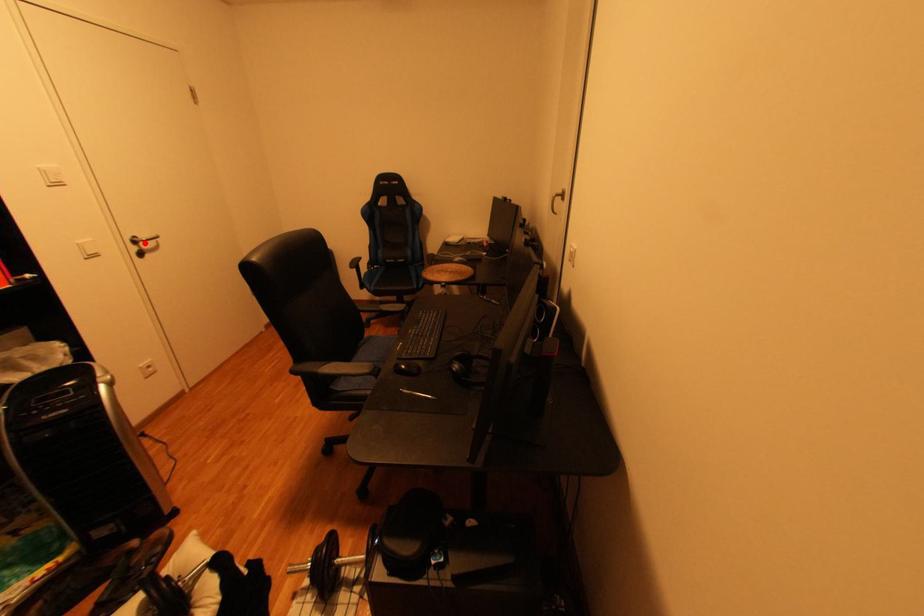
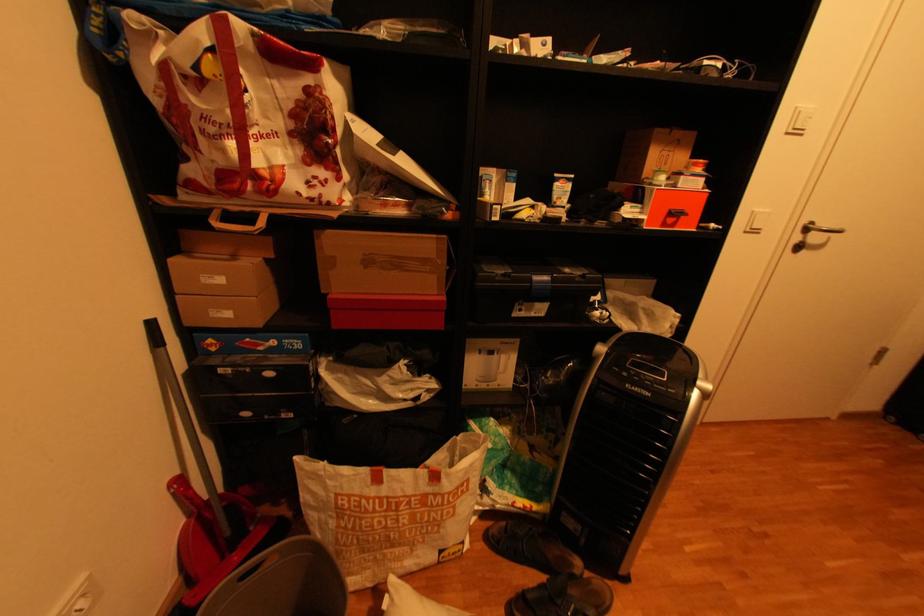
The point at the highlighted location is marked in the first image. Where is the corresponding point in the second image?

(816, 230)